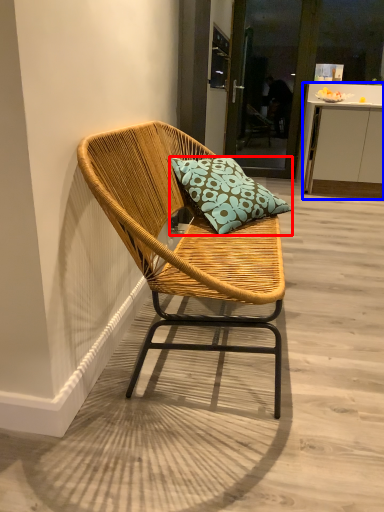
Question: Among these objects, which one is nearest to the camera, pillow (highlighted by a red box) or cabinetry (highlighted by a blue box)?

Choices:
 (A) pillow
 (B) cabinetry

Answer: (A)